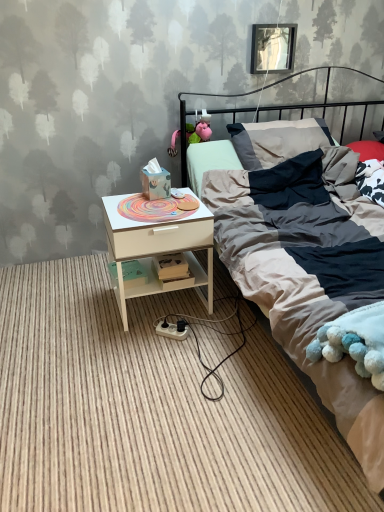
This screenshot has width=384, height=512. Identify the location of metallic rectangular frame at upper center. (273, 48).

Describe the element at coordinates (150, 410) in the screenshot. I see `white wood nightstand at lower left` at that location.

Where is `textured cotton bed at center`? Image resolution: width=384 pixels, height=512 pixels. textured cotton bed at center is located at coordinates (305, 256).

In order to click on plain below the metallic rectangular frame at upper center (from a real-world perspective) in this screenshot , I will do `click(150, 410)`.

From the image's perspective, is white wood nightstand at lower left above metallic rectangular frame at upper center?

No, from the image's perspective, white wood nightstand at lower left is not above metallic rectangular frame at upper center.

Choose the correct answer: Is white wood nightstand at lower left inside metallic rectangular frame at upper center or outside it?

white wood nightstand at lower left is not enclosed by metallic rectangular frame at upper center.

In the scene shown: Does white wood nightstand at lower left have a lesser height compared to metallic rectangular frame at upper center?

Correct, white wood nightstand at lower left is not as tall as metallic rectangular frame at upper center.

Does textured cotton bed at center turn towards white wood nightstand at lower left?

No, textured cotton bed at center is not turned towards white wood nightstand at lower left.

Is textured cotton bed at center wider than white wood nightstand at lower left?

Indeed, textured cotton bed at center has a greater width compared to white wood nightstand at lower left.

From a real-world perspective, is textured cotton bed at center above or below white wood nightstand at lower left?

Clearly, from a real-world perspective, textured cotton bed at center is above white wood nightstand at lower left.

From a real-world perspective, does white wood nightstand at lower left sit lower than white wood nightstand at lower left?

Correct, in the physical world, white wood nightstand at lower left is lower than white wood nightstand at lower left.

Can you confirm if white wood nightstand at lower left is bigger than white wood nightstand at lower left?

Yes.

Find the location of a particular element. The height and width of the screenshot is (512, 384). nightstand on the right of white wood nightstand at lower left is located at coordinates (157, 244).

How many degrees apart are the facing directions of white wood nightstand at lower left and white wood nightstand at lower left?

The facing directions of white wood nightstand at lower left and white wood nightstand at lower left are 90.7 degrees apart.

Where is `picture frame that is on the right side of white wood nightstand at lower left`? picture frame that is on the right side of white wood nightstand at lower left is located at coordinates (273, 48).

Can you confirm if white wood nightstand at lower left is thinner than metallic rectangular frame at upper center?

No.

What's the angular difference between white wood nightstand at lower left and metallic rectangular frame at upper center's facing directions?

They differ by 0.0508 degrees in their facing directions.

Could metallic rectangular frame at upper center be considered to be inside white wood nightstand at lower left?

No, metallic rectangular frame at upper center is located outside of white wood nightstand at lower left.

Based on the photo, from the image's perspective, which object appears higher, textured cotton bed at center or metallic rectangular frame at upper center?

metallic rectangular frame at upper center, from the image's perspective.

Between textured cotton bed at center and metallic rectangular frame at upper center, which one has smaller size?

metallic rectangular frame at upper center.

This screenshot has height=512, width=384. What are the coordinates of `picture frame lying on the left of textured cotton bed at center` in the screenshot? It's located at (273, 48).

Is textured cotton bed at center touching metallic rectangular frame at upper center?

No, textured cotton bed at center is not with metallic rectangular frame at upper center.

Considering the points (273, 68) and (42, 362), which point is in front, point (273, 68) or point (42, 362)?

The point (42, 362) is more forward.

Can you see metallic rectangular frame at upper center touching white wood nightstand at lower left?

metallic rectangular frame at upper center and white wood nightstand at lower left are clearly separated.

Is metallic rectangular frame at upper center facing towards white wood nightstand at lower left?

No, metallic rectangular frame at upper center is not turned towards white wood nightstand at lower left.

Does metallic rectangular frame at upper center have a lesser height compared to white wood nightstand at lower left?

No.

Based on their positions, is metallic rectangular frame at upper center located to the left or right of textured cotton bed at center?

Based on their positions, metallic rectangular frame at upper center is located to the left of textured cotton bed at center.

From the image's perspective, is metallic rectangular frame at upper center above textured cotton bed at center?

Yes, from the image's perspective, metallic rectangular frame at upper center is above textured cotton bed at center.

This screenshot has height=512, width=384. Find the location of `bed in front of the metallic rectangular frame at upper center`. bed in front of the metallic rectangular frame at upper center is located at coordinates (305, 256).

Could you tell me if metallic rectangular frame at upper center is turned towards textured cotton bed at center?

No, metallic rectangular frame at upper center is not oriented towards textured cotton bed at center.

At what (x,y) coordinates should I click in order to perform the action: click on picture frame behind the white wood nightstand at lower left. Please return your answer as a coordinate pair (x, y). Looking at the image, I should click on (273, 48).

Where is `nightstand located underneath the textured cotton bed at center (from a real-world perspective)`? This screenshot has height=512, width=384. nightstand located underneath the textured cotton bed at center (from a real-world perspective) is located at coordinates (157, 244).

When comparing their distances from metallic rectangular frame at upper center, does white wood nightstand at lower left or white wood nightstand at lower left seem closer?

white wood nightstand at lower left.

From the picture: Considering their positions, is white wood nightstand at lower left positioned further to white wood nightstand at lower left than textured cotton bed at center?

The object further to white wood nightstand at lower left is textured cotton bed at center.

From the image, which object appears to be farther from white wood nightstand at lower left, white wood nightstand at lower left or metallic rectangular frame at upper center?

The object further to white wood nightstand at lower left is metallic rectangular frame at upper center.

Estimate the real-world distances between objects in this image. Which object is closer to metallic rectangular frame at upper center, white wood nightstand at lower left or textured cotton bed at center?

Among the two, textured cotton bed at center is located nearer to metallic rectangular frame at upper center.

Which object lies further to the anchor point textured cotton bed at center, metallic rectangular frame at upper center or white wood nightstand at lower left?

The object further to textured cotton bed at center is metallic rectangular frame at upper center.

Estimate the real-world distances between objects in this image. Which object is closer to metallic rectangular frame at upper center, white wood nightstand at lower left or white wood nightstand at lower left?

white wood nightstand at lower left lies closer to metallic rectangular frame at upper center than the other object.

Estimate the real-world distances between objects in this image. Which object is closer to white wood nightstand at lower left, textured cotton bed at center or white wood nightstand at lower left?

textured cotton bed at center.

Considering their positions, is metallic rectangular frame at upper center positioned closer to textured cotton bed at center than white wood nightstand at lower left?

white wood nightstand at lower left is positioned closer to the anchor textured cotton bed at center.

Find the location of a particular element. The image size is (384, 512). plain between textured cotton bed at center and metallic rectangular frame at upper center in the front-back direction is located at coordinates point(150,410).

Where is `nightstand between textured cotton bed at center and metallic rectangular frame at upper center from front to back`? This screenshot has width=384, height=512. nightstand between textured cotton bed at center and metallic rectangular frame at upper center from front to back is located at coordinates (157, 244).

At what (x,y) coordinates should I click in order to perform the action: click on nightstand between metallic rectangular frame at upper center and white wood nightstand at lower left in the vertical direction. Please return your answer as a coordinate pair (x, y). Looking at the image, I should click on [x=157, y=244].

The image size is (384, 512). Identify the location of nightstand between white wood nightstand at lower left and textured cotton bed at center. (157, 244).